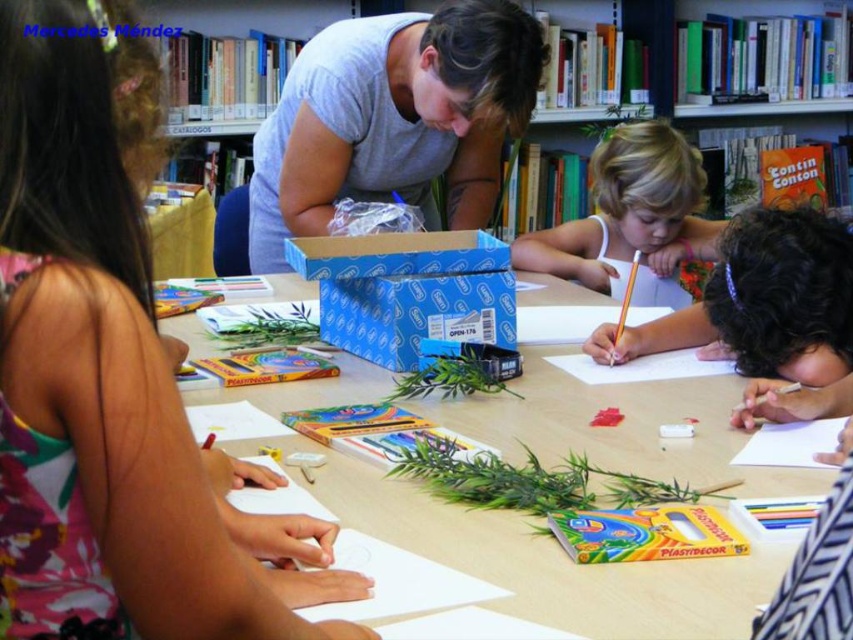
Question: Which point is closer to the camera?

Choices:
 (A) 279,164
 (B) 165,531
 (C) 840,340

Answer: (B)

Question: Considering the relative positions of wooden table at center and blonde hair at center in the image provided, where is wooden table at center located with respect to blonde hair at center?

Choices:
 (A) right
 (B) left

Answer: (B)

Question: Is matte gray shirt at upper center further to the viewer compared to blonde hair at center?

Choices:
 (A) yes
 (B) no

Answer: (B)

Question: Is white paper at center bigger than blonde hair at center?

Choices:
 (A) no
 (B) yes

Answer: (A)

Question: Estimate the real-world distances between objects in this image. Which object is closer to the white paper at center?

Choices:
 (A) blonde hair at center
 (B) matte gray shirt at upper center
 (C) wooden table at center
 (D) gray matte shirt at center

Answer: (C)

Question: Which object is closer to the camera taking this photo?

Choices:
 (A) wooden table at center
 (B) blonde hair at center

Answer: (A)